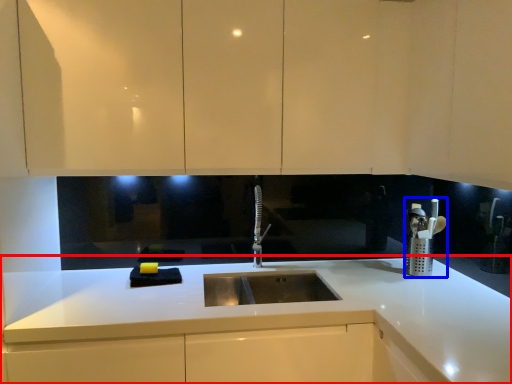
Question: Which of the following is the closest to the observer, countertop (highlighted by a red box) or appliance (highlighted by a blue box)?

Choices:
 (A) countertop
 (B) appliance

Answer: (A)